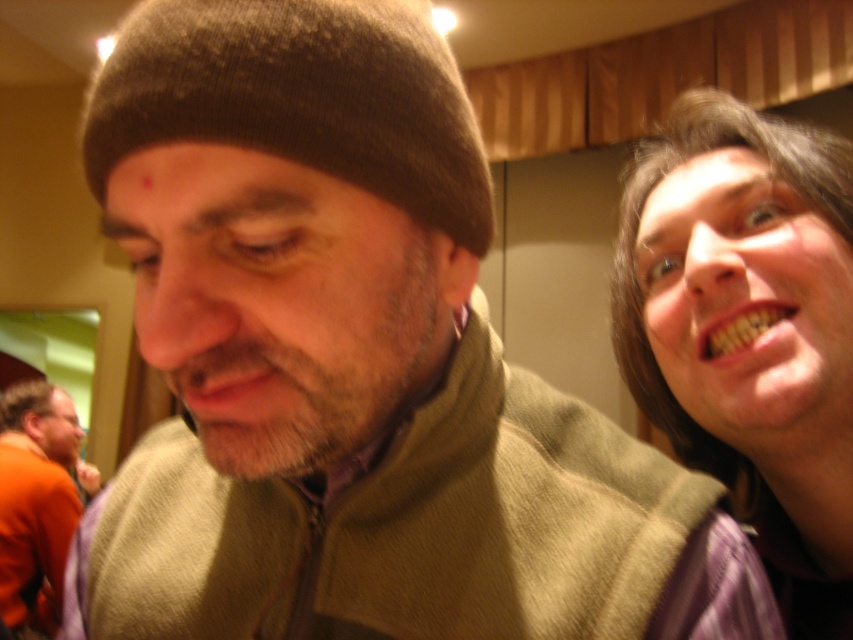
Question: Does matte purple shirt at right have a greater width compared to orange matte shirt at lower left?

Choices:
 (A) yes
 (B) no

Answer: (B)

Question: Can you confirm if matte purple shirt at right is positioned to the left of brown knit beanie at upper left?

Choices:
 (A) no
 (B) yes

Answer: (A)

Question: Which is farther from the matte purple shirt at right?

Choices:
 (A) brown knit beanie at upper left
 (B) orange matte shirt at lower left

Answer: (B)

Question: Which point is closer to the camera taking this photo?

Choices:
 (A) (733, 333)
 (B) (422, 61)

Answer: (B)

Question: Does matte purple shirt at right have a lesser width compared to brown knit beanie at upper left?

Choices:
 (A) yes
 (B) no

Answer: (A)

Question: Which of the following is the closest to the observer?

Choices:
 (A) (769, 470)
 (B) (102, 188)
 (C) (55, 404)

Answer: (B)